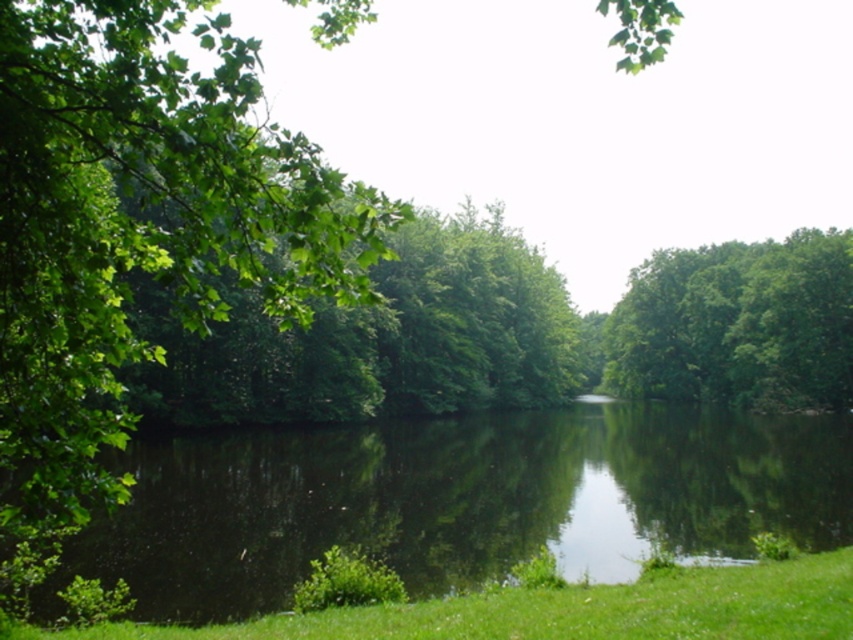
Which of these two, green reflective water at center or green grass at lower center, stands taller?

Standing taller between the two is green reflective water at center.

How far apart are green reflective water at center and green grass at lower center?

A distance of 18.55 meters exists between green reflective water at center and green grass at lower center.

Who is more forward, (566, 420) or (845, 620)?

Point (845, 620)

The width and height of the screenshot is (853, 640). I want to click on green reflective water at center, so click(457, 500).